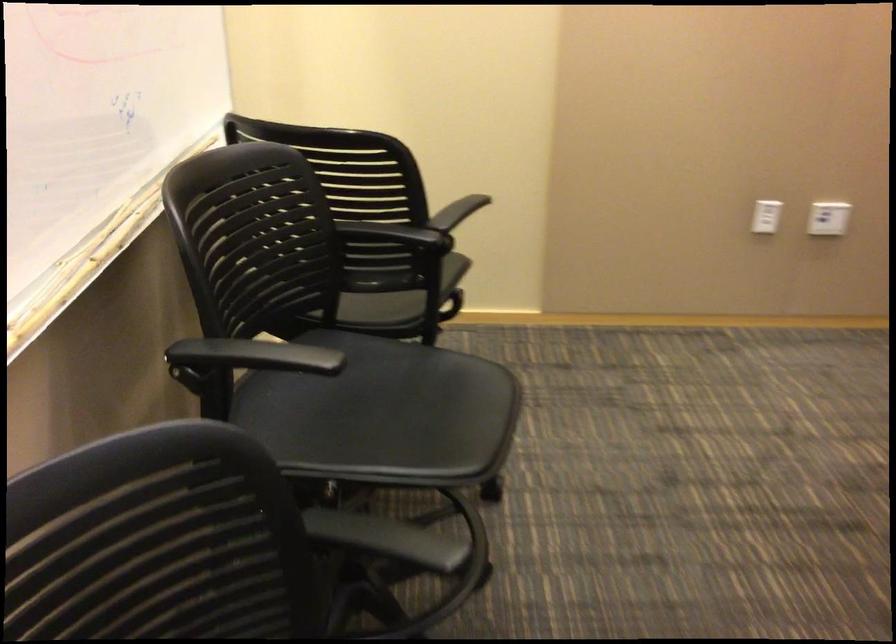
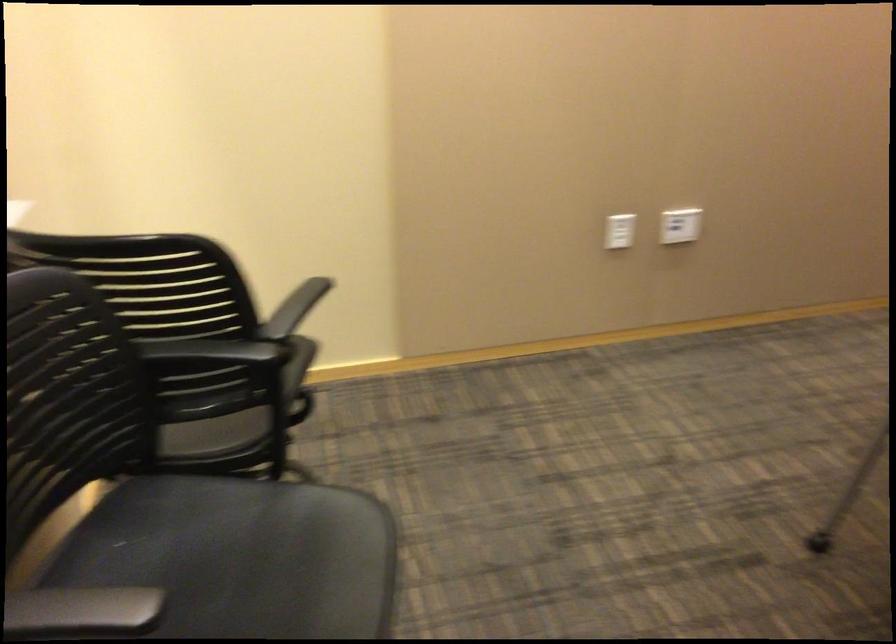
Locate, in the second image, the point that corresponds to point 395,390 in the first image.

(239, 556)